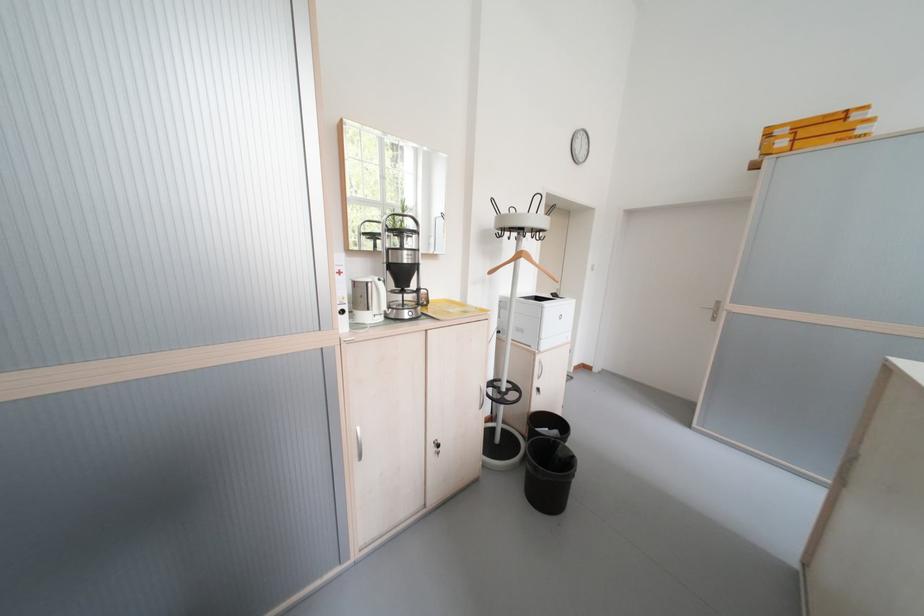
Identify the location of white kettle handle. (380, 291).